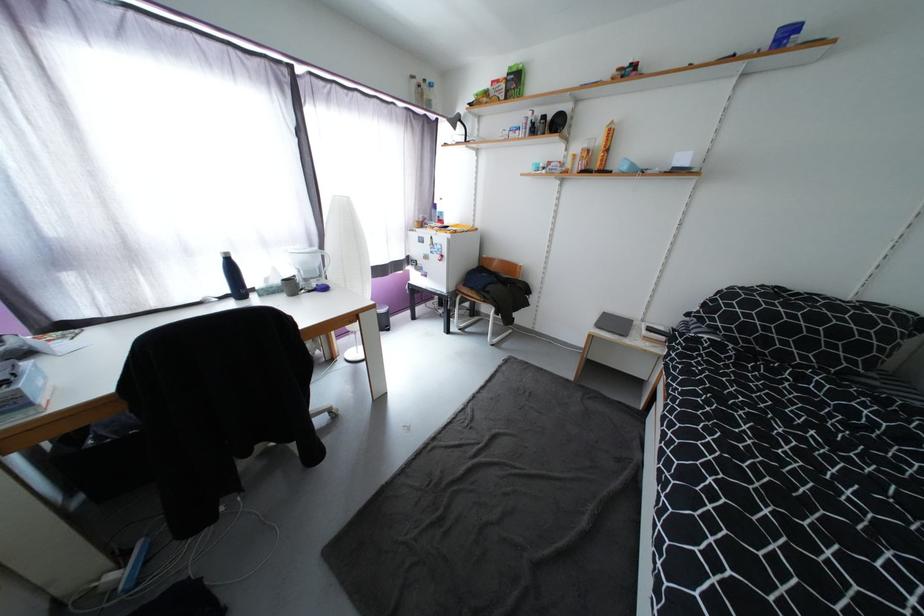
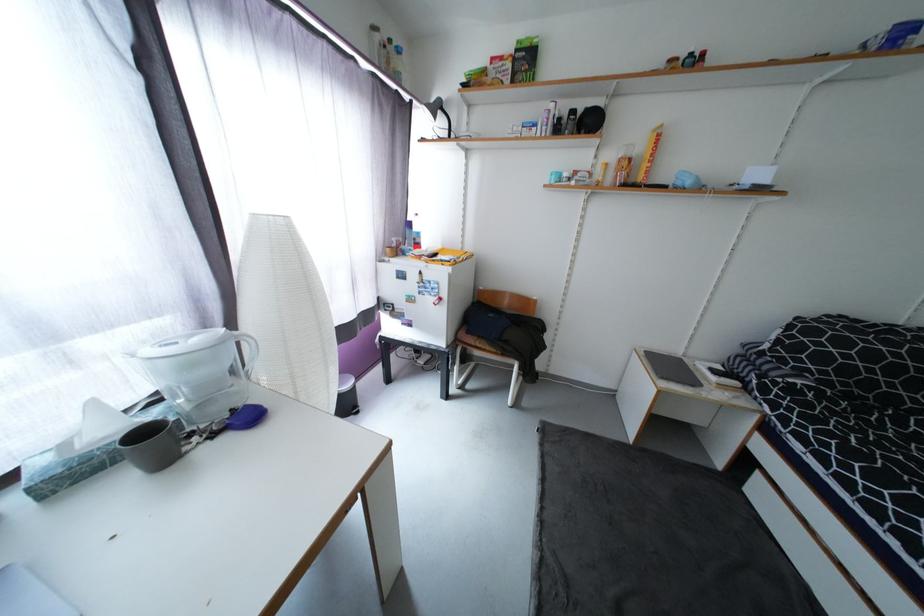
The point at (x=433, y=243) is marked in the first image. Where is the corresponding point in the second image?

(419, 278)